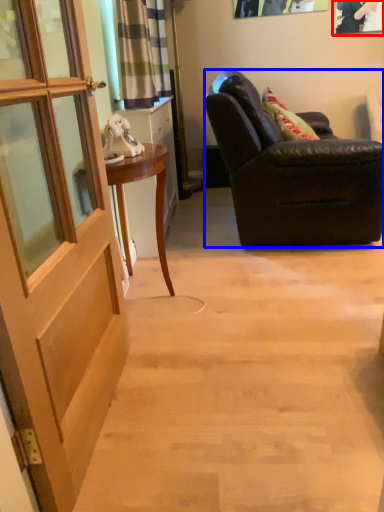
Question: Which object is further to the camera taking this photo, picture frame (highlighted by a red box) or chair (highlighted by a blue box)?

Choices:
 (A) picture frame
 (B) chair

Answer: (A)